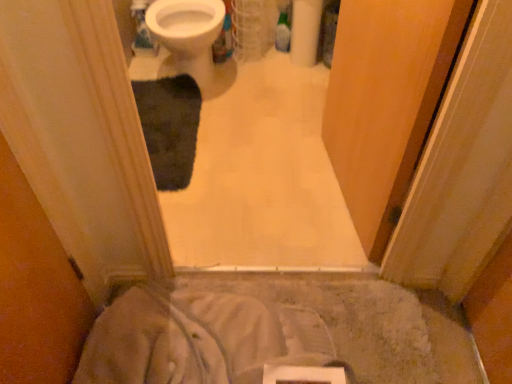
Where is `vacant space to the right of dark gray plush bath mat at center`? This screenshot has width=512, height=384. vacant space to the right of dark gray plush bath mat at center is located at coordinates (253, 136).